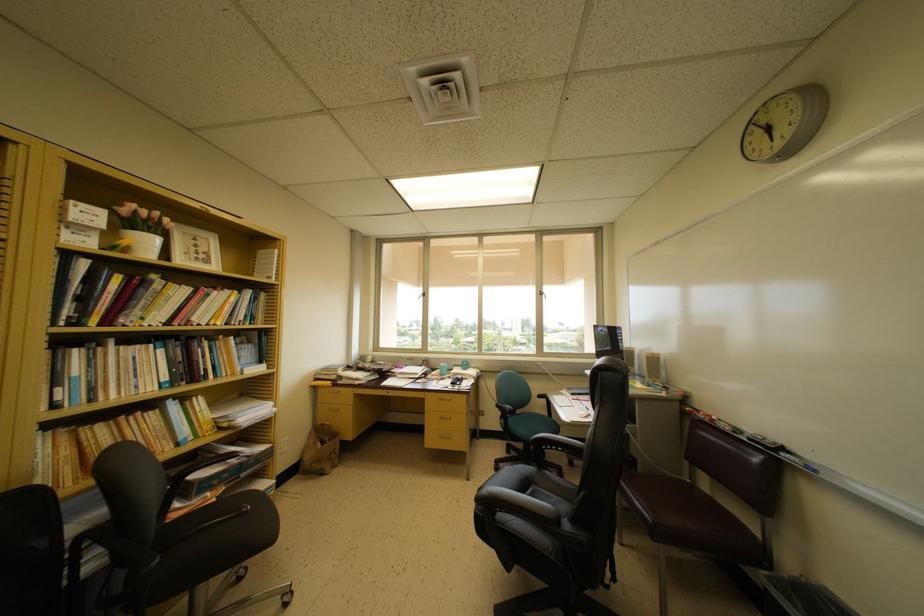
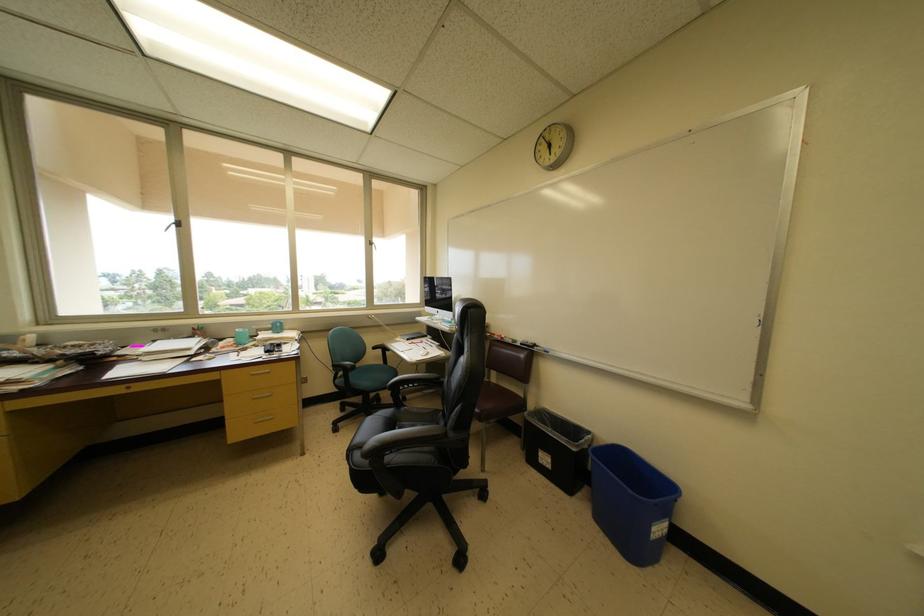
Find the pixel in the second image that matches (x=658, y=527) in the first image.

(485, 416)